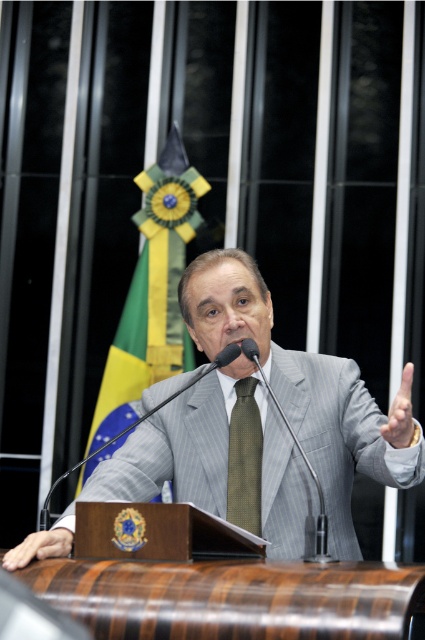
Question: Is green fabric flag at center smaller than green textured tie at center?

Choices:
 (A) yes
 (B) no

Answer: (B)

Question: Which object is the closest to the green textured tie at center?

Choices:
 (A) smooth skin hand at lower left
 (B) metallic silver microphone at center
 (C) gray striped suit at center

Answer: (C)

Question: Observing the image, what is the correct spatial positioning of gray striped suit at center in reference to green textured tie at center?

Choices:
 (A) above
 (B) below

Answer: (A)

Question: Which of these objects is positioned closest to the gray fabric hand at center?

Choices:
 (A) metallic silver microphone at center
 (B) smooth skin hand at lower left
 (C) green textured tie at center

Answer: (A)

Question: Among these points, which one is farthest from the camera?

Choices:
 (A) (316, 532)
 (B) (6, 556)
 (C) (399, 429)
 (D) (161, 355)

Answer: (D)

Question: Can you confirm if green textured tie at center is positioned to the left of metallic silver microphone at center?

Choices:
 (A) no
 (B) yes

Answer: (B)